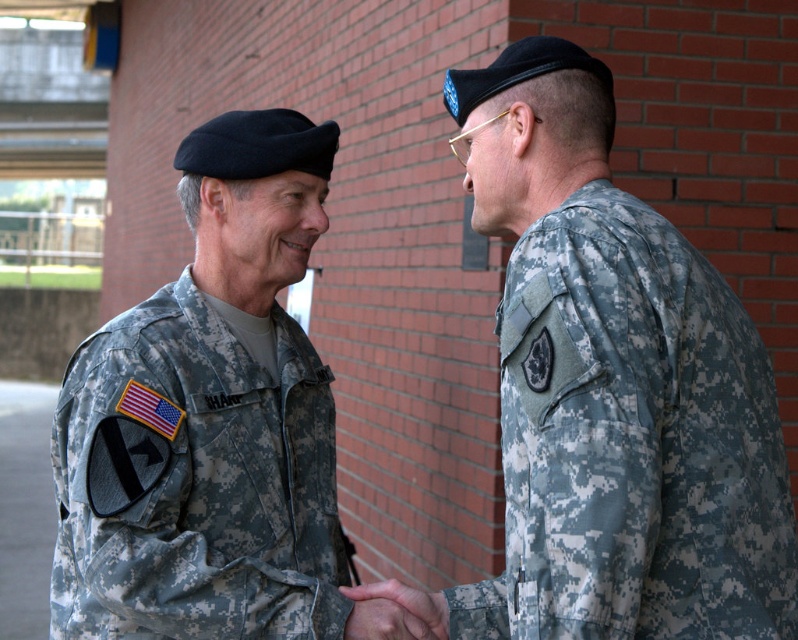
Question: Does camouflage uniform at right have a lesser width compared to camouflage fabric hand at center?

Choices:
 (A) yes
 (B) no

Answer: (B)

Question: Can you confirm if camouflage uniform at right is smaller than camouflage fabric uniform at left?

Choices:
 (A) yes
 (B) no

Answer: (B)

Question: Considering the relative positions of camouflage uniform at right and camouflage fabric uniform at left in the image provided, where is camouflage uniform at right located with respect to camouflage fabric uniform at left?

Choices:
 (A) right
 (B) left

Answer: (A)

Question: Which object is the farthest from the camouflage fabric hand at center?

Choices:
 (A) camouflage fabric uniform at left
 (B) camouflage uniform at right

Answer: (B)

Question: Which point appears farthest from the camera in this image?

Choices:
 (A) (654, 442)
 (B) (429, 620)

Answer: (B)

Question: Which point is closer to the camera?

Choices:
 (A) (421, 596)
 (B) (534, 52)

Answer: (B)